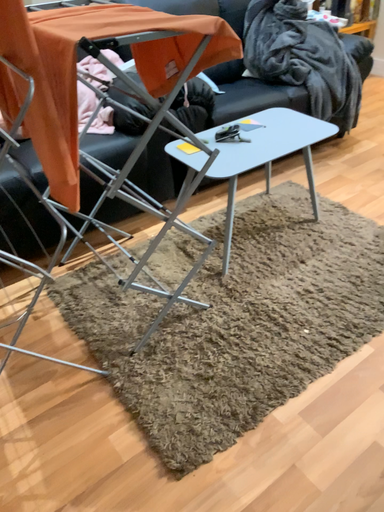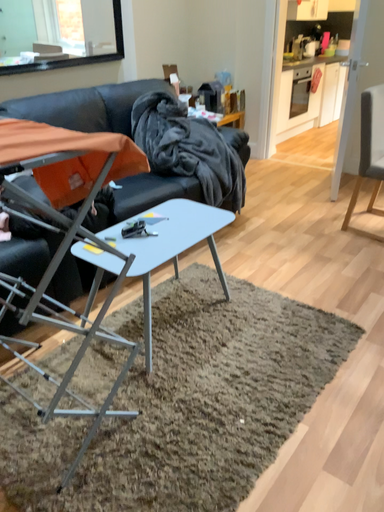
Question: Which way did the camera rotate in the video?

Choices:
 (A) rotated left
 (B) rotated right

Answer: (B)